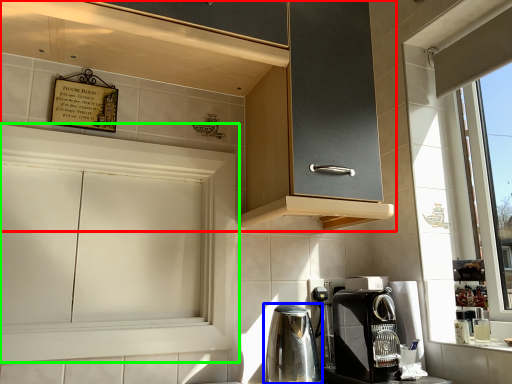
Question: Which object is the closest to the cabinetry (highlighted by a red box)? Choose among these: home appliance (highlighted by a blue box) or cabinetry (highlighted by a green box).

Choices:
 (A) home appliance
 (B) cabinetry

Answer: (B)